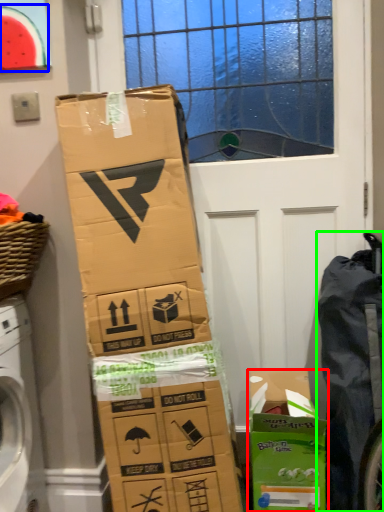
Question: Estimate the real-world distances between objects in this image. Which object is farther from cardboard box (highlighted by a red box), watermelon (highlighted by a blue box) or waste (highlighted by a green box)?

Choices:
 (A) watermelon
 (B) waste

Answer: (A)